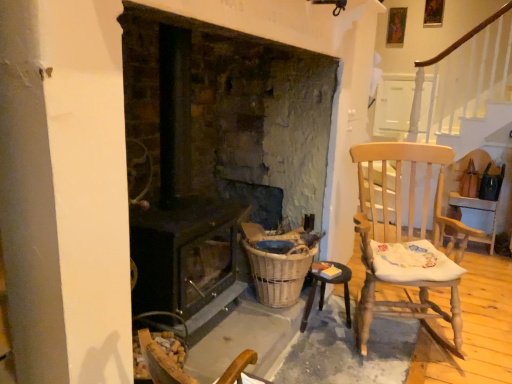
At what (x,y) coordinates should I click in order to perform the action: click on free spot below light wood rocking chair at right (from a real-world perspective). Please return your answer as a coordinate pair (x, y). Looking at the image, I should click on (405, 341).